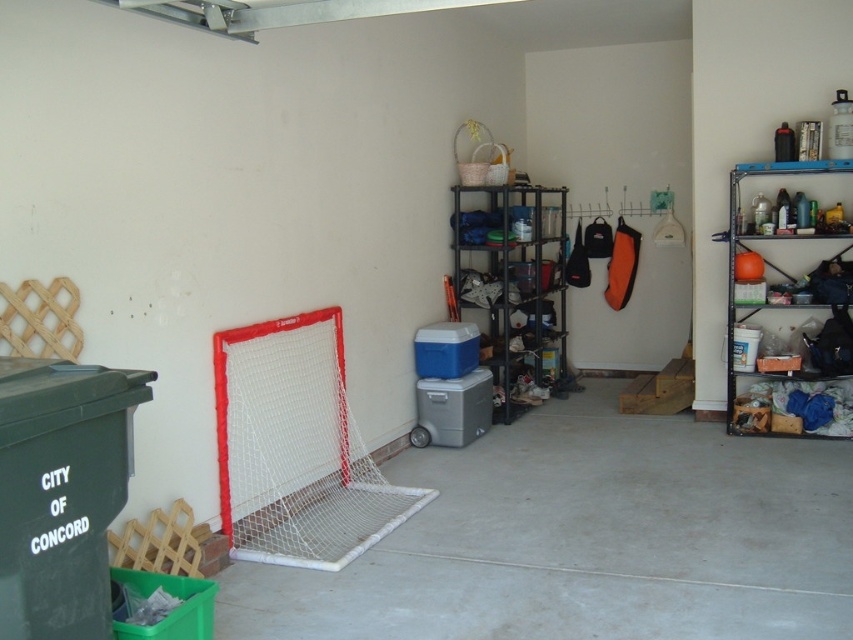
Is green plastic cooler at lower left below metallic black shelving unit at center?

Yes.

Can you confirm if green plastic cooler at lower left is shorter than metallic black shelving unit at center?

Yes.

Is point (12, 595) farther from viewer compared to point (550, 225)?

No, it is not.

Locate an element on the screen. This screenshot has width=853, height=640. green plastic cooler at lower left is located at coordinates (61, 492).

Is white mesh net at left wider than orange matte sports ball at right?

Yes, white mesh net at left is wider than orange matte sports ball at right.

Is point (389, 525) closer to viewer compared to point (764, 164)?

Yes, it is.

Is point (286, 428) closer to viewer compared to point (810, 416)?

Yes, point (286, 428) is closer to viewer.

Where is `white mesh net at left`? white mesh net at left is located at coordinates (296, 449).

Does green plastic cooler at lower left have a larger size compared to orange matte sports ball at right?

Actually, green plastic cooler at lower left might be smaller than orange matte sports ball at right.

Describe the element at coordinates (61, 492) in the screenshot. The image size is (853, 640). I see `green plastic cooler at lower left` at that location.

The height and width of the screenshot is (640, 853). I want to click on green plastic cooler at lower left, so click(x=61, y=492).